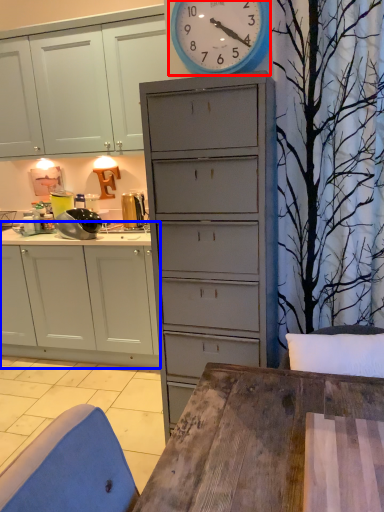
Question: Which point is closer to the camera, wall clock (highlighted by a red box) or cabinetry (highlighted by a blue box)?

Choices:
 (A) wall clock
 (B) cabinetry

Answer: (A)